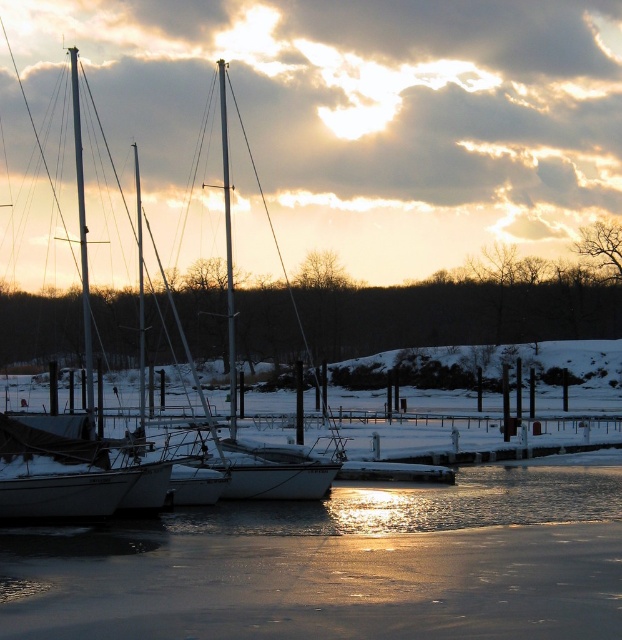
Looking at this image, you are standing at the edge of the marina and notice a point marked at coordinates (341, 564). Based on the scene description, what does this point most likely represent?

The point at (341, 564) most likely represents icy white water at center as described in the scene.

You are a photographer planning to capture the sunset at the marina. You notice the icy white water at center and the white matte sailboat at center. Which object would you focus on if you want to highlight something smaller in the scene?

The icy white water at center has a smaller size compared to the white matte sailboat at center, so focusing on the icy white water at center would highlight the smaller object in the scene.

You are standing at the marina and want to take a photo of the icy white water at center and the white matte sailboat at center. Which object should you focus on first to ensure both are in sharp focus?

You should focus on the white matte sailboat at center first because it is farther away from the viewer than the icy white water at center, so adjusting focus from far to near can help achieve sharpness for both.